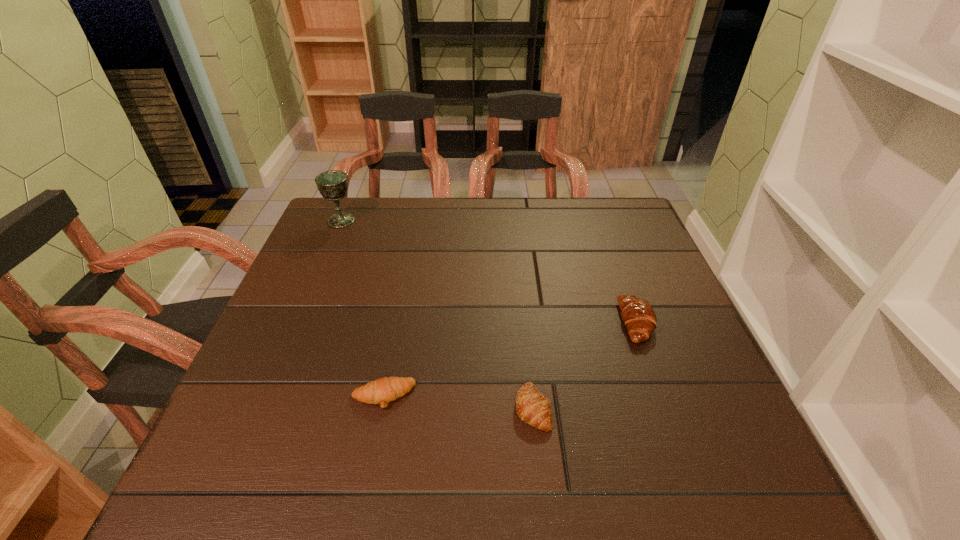
Locate an element on the screen. This screenshot has width=960, height=540. object situated at the far edge is located at coordinates (333, 185).

This screenshot has width=960, height=540. In order to click on object that is at the left edge in this screenshot , I will do `click(333, 185)`.

Identify the location of object that is at the right edge. Image resolution: width=960 pixels, height=540 pixels. (637, 314).

Locate an element on the screen. This screenshot has width=960, height=540. object that is at the far left corner is located at coordinates (333, 185).

The height and width of the screenshot is (540, 960). What are the coordinates of `free spot at the far edge of the desktop` in the screenshot? It's located at (579, 234).

The image size is (960, 540). In the image, there is a desktop. Find the location of `free space at the left edge`. free space at the left edge is located at coordinates pos(342,275).

Find the location of a particular element. This screenshot has width=960, height=540. free space at the right edge of the desktop is located at coordinates (664, 280).

Locate an element on the screen. vacant space at the far left corner of the desktop is located at coordinates (364, 238).

Locate an element on the screen. The height and width of the screenshot is (540, 960). empty space between the chalice and the rightmost object is located at coordinates (489, 272).

This screenshot has width=960, height=540. What are the coordinates of `vacant space that is in between the leftmost object and the second crescent roll from left to right` in the screenshot? It's located at (437, 314).